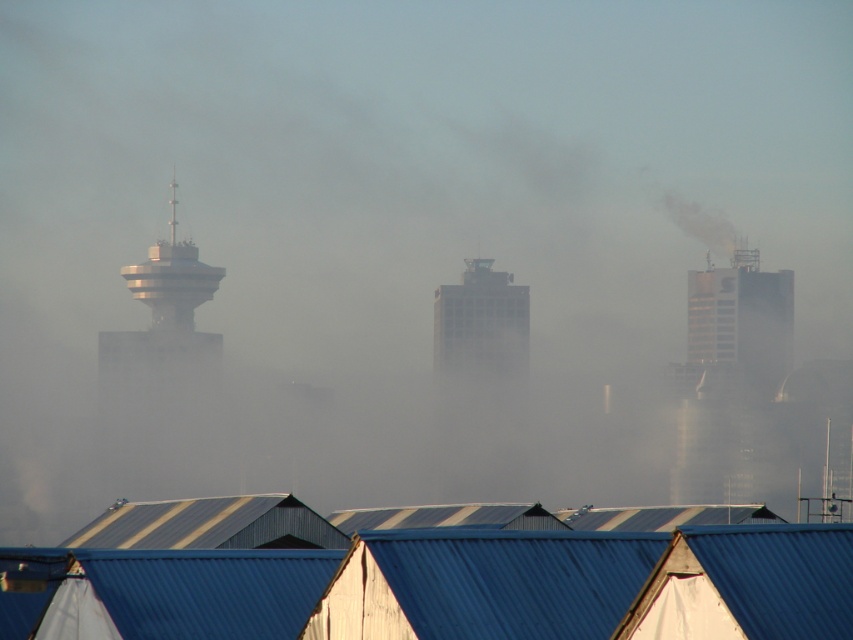
Who is more distant from viewer, (x=33, y=554) or (x=450, y=339)?

The point (x=450, y=339) is behind.

Does blue corrugated metal at lower center come behind gray concrete building at center?

That is False.

Is point (184, 620) behind point (473, 269)?

No, it is not.

At what (x,y) coordinates should I click in order to perform the action: click on blue corrugated metal at lower center. Please return your answer as a coordinate pair (x, y). Looking at the image, I should click on (445, 586).